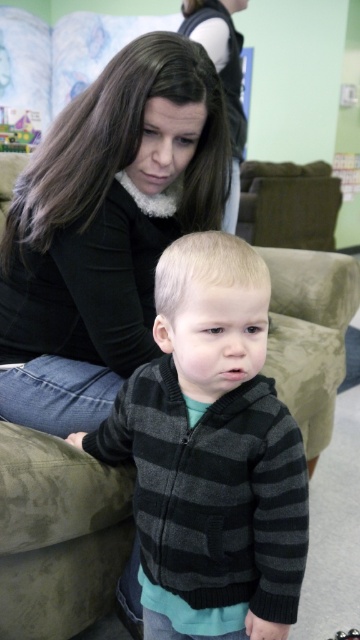
Question: Is matte black sweater at center positioned before dark brown hair at upper center?

Choices:
 (A) yes
 (B) no

Answer: (A)

Question: Estimate the real-world distances between objects in this image. Which object is farther from the dark brown hair at upper center?

Choices:
 (A) matte black sweater at center
 (B) striped knit sweater at center

Answer: (B)

Question: Can you confirm if matte black sweater at center is smaller than dark brown hair at upper center?

Choices:
 (A) no
 (B) yes

Answer: (B)

Question: Does striped knit sweater at center appear over dark brown hair at upper center?

Choices:
 (A) no
 (B) yes

Answer: (A)

Question: Which of these objects is positioned farthest from the striped knit sweater at center?

Choices:
 (A) matte black sweater at center
 (B) dark brown hair at upper center

Answer: (B)

Question: Which of the following is the closest to the observer?

Choices:
 (A) tap(111, 224)
 (B) tap(232, 152)
 (C) tap(210, 493)

Answer: (C)